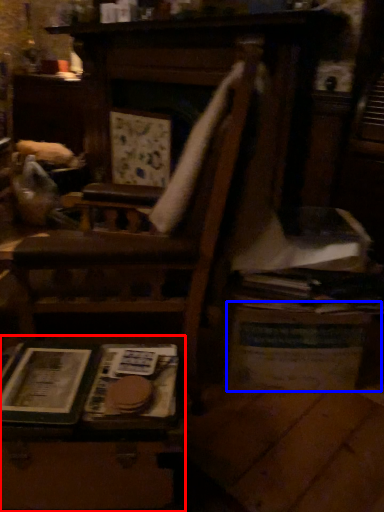
Question: Which of the following is the closest to the observer, table (highlighted by a red box) or table (highlighted by a blue box)?

Choices:
 (A) table
 (B) table

Answer: (A)